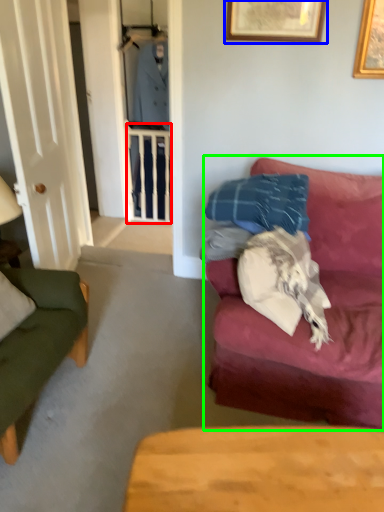
Question: Considering the real-world distances, which object is farthest from balustrade (highlighted by a red box)? picture frame (highlighted by a blue box) or studio couch (highlighted by a green box)?

Choices:
 (A) picture frame
 (B) studio couch

Answer: (B)